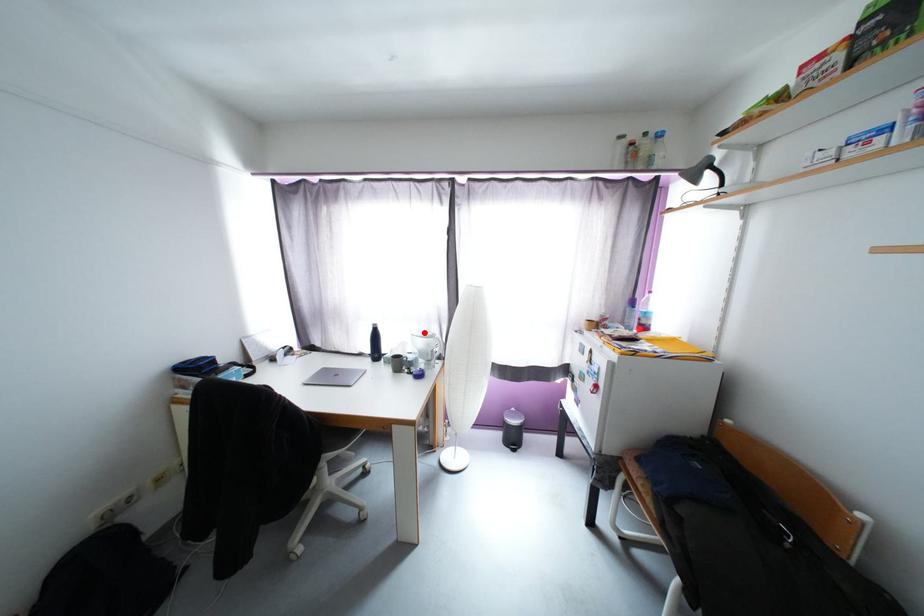
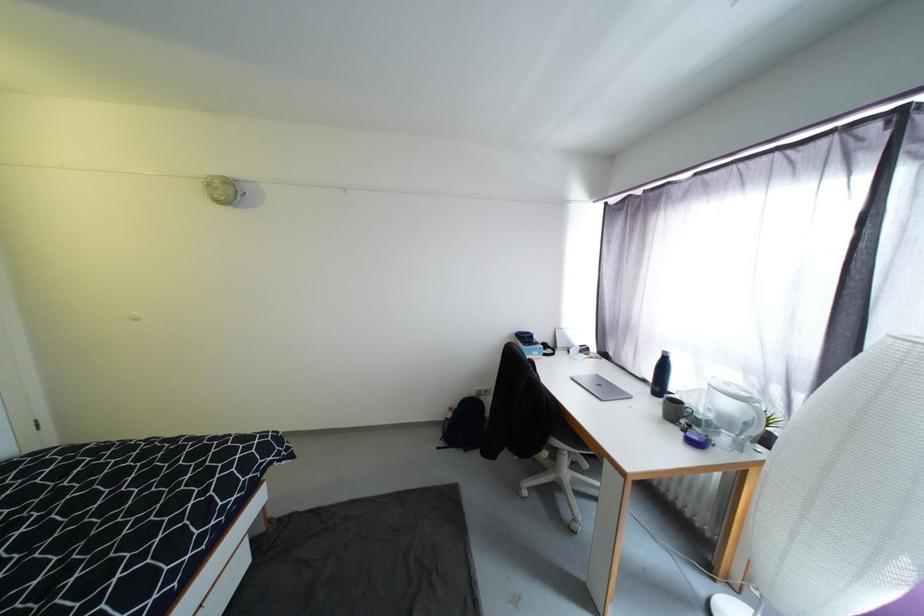
In the second image, find the point that corresponds to the highlighted location in the first image.

(733, 386)